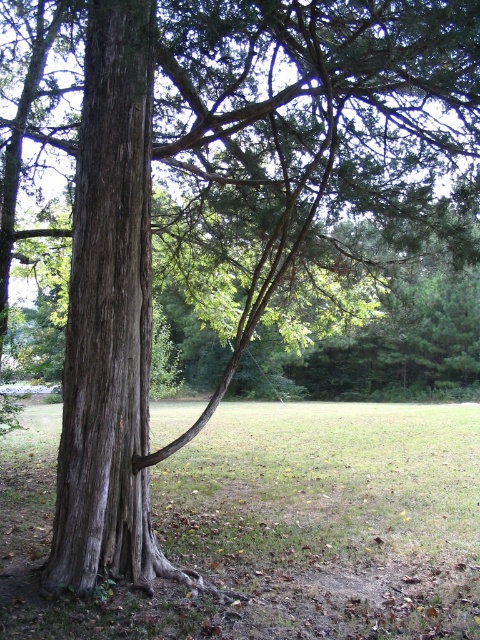
You are standing in the park looking at the large weathered tree. There are two points marked on the tree trunk. One is at coordinate point (336, 540) and the other is at point (139, 540). Which point is closer to you?

Point (139, 540) is closer to you because it is less further to the camera than point (336, 540).